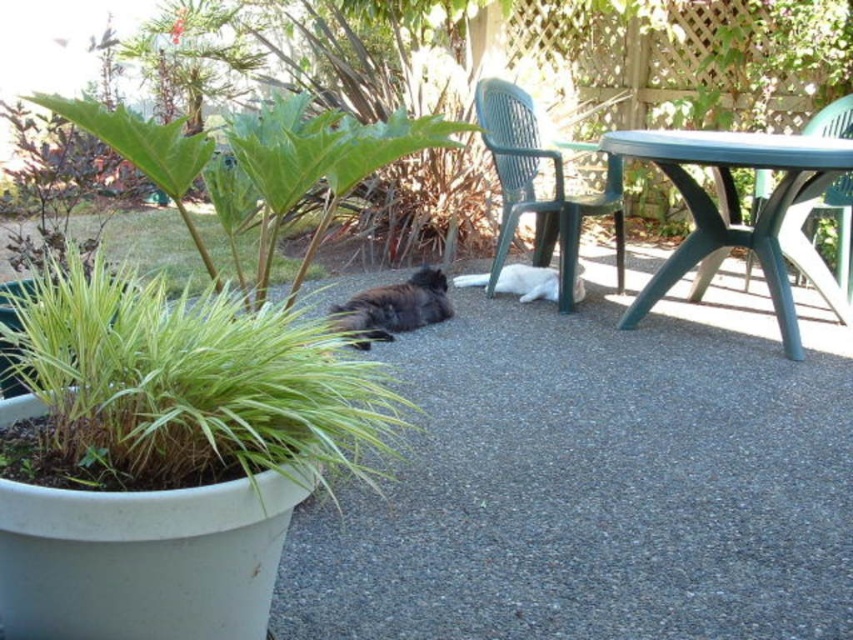
Does green plastic table at upper right have a smaller size compared to white fur cat at center?

No.

Does point (764, 202) come closer to viewer compared to point (524, 280)?

Yes, it is in front of point (524, 280).

Find the location of a particular element. The image size is (853, 640). green plastic table at upper right is located at coordinates (733, 204).

Which is more to the left, green plastic table at upper right or dark gray fur at center?

dark gray fur at center is more to the left.

Is green plastic table at upper right to the right of dark gray fur at center from the viewer's perspective?

Yes, green plastic table at upper right is to the right of dark gray fur at center.

Locate an element on the screen. The image size is (853, 640). green plastic table at upper right is located at coordinates (733, 204).

Does green plastic chair at center have a smaller size compared to white fur cat at center?

No, green plastic chair at center is not smaller than white fur cat at center.

Locate an element on the screen. The height and width of the screenshot is (640, 853). green plastic chair at center is located at coordinates (532, 179).

Between point (505, 118) and point (467, 284), which one is positioned behind?

The point (467, 284) is behind.

Locate an element on the screen. Image resolution: width=853 pixels, height=640 pixels. green plastic chair at center is located at coordinates (532, 179).